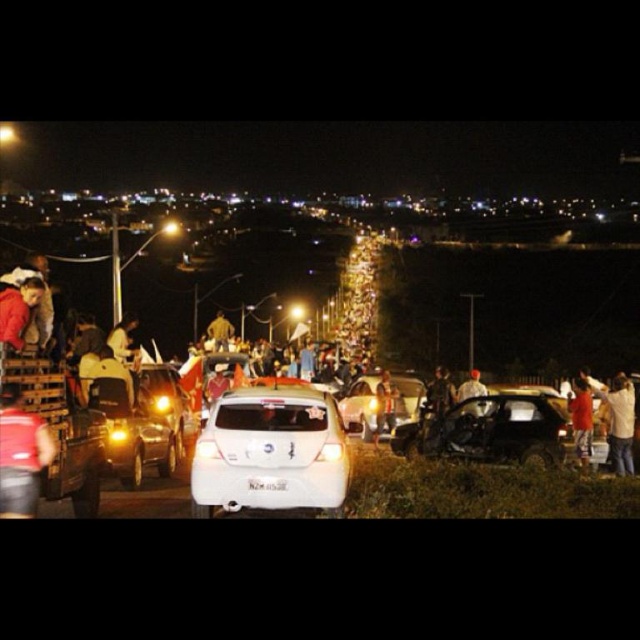
Question: Which point is closer to the camera?

Choices:
 (A) metallic silver truck at lower left
 (B) orange fabric shirt at right
 (C) light brown leather jacket at right
 (D) white fabric shirt at center

Answer: (A)

Question: Does light brown leather jacket at right appear on the left side of white fabric shirt at center?

Choices:
 (A) yes
 (B) no

Answer: (B)

Question: Is illuminated plastic lights at center wider than light brown leather jacket at right?

Choices:
 (A) no
 (B) yes

Answer: (A)

Question: Among these points, which one is nearest to the camera?

Choices:
 (A) (362, 285)
 (B) (106, 384)
 (C) (484, 416)
 (D) (365, 400)

Answer: (B)

Question: Which point is closer to the camera taking this photo?

Choices:
 (A) (64, 419)
 (B) (499, 396)
 (C) (140, 394)

Answer: (A)

Question: Is damaged matte black car at center above shiny metallic sedan at center-left?

Choices:
 (A) yes
 (B) no

Answer: (B)